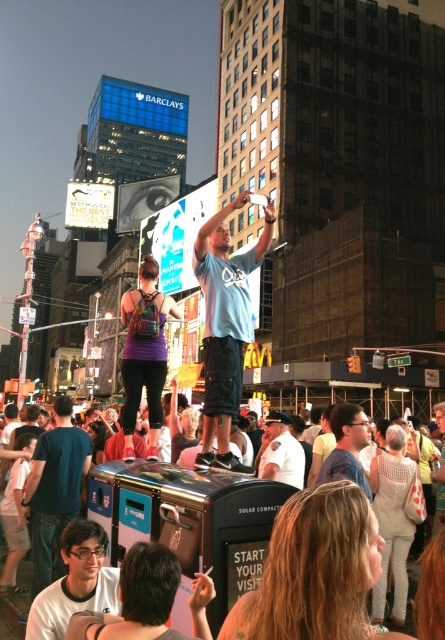
Question: Does metallic trash can at center have a lesser width compared to matte blue shirt at center?

Choices:
 (A) no
 (B) yes

Answer: (A)

Question: Which point is closer to the camera?

Choices:
 (A) (271, 477)
 (B) (63, 458)
 (C) (351, 429)

Answer: (C)

Question: Which object appears closest to the camera in this image?

Choices:
 (A) matte blue shirt at center
 (B) matte blue shirt at lower left
 (C) light blue t-shirt at center

Answer: (C)

Question: Is the position of light blue t-shirt at center less distant than that of matte blue shirt at center?

Choices:
 (A) no
 (B) yes

Answer: (B)

Question: Can you confirm if metallic trash can at center is smaller than white matte t-shirt at lower left?

Choices:
 (A) no
 (B) yes

Answer: (A)

Question: Which point is farther to the camera?

Choices:
 (A) (287, 451)
 (B) (45, 513)
 (C) (187, 525)

Answer: (A)